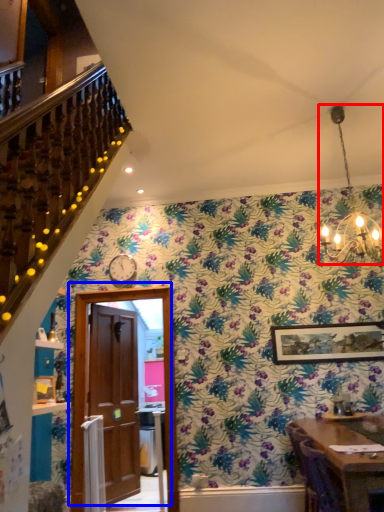
Question: Among these objects, which one is nearest to the camera, light fixture (highlighted by a red box) or door (highlighted by a blue box)?

Choices:
 (A) light fixture
 (B) door

Answer: (A)